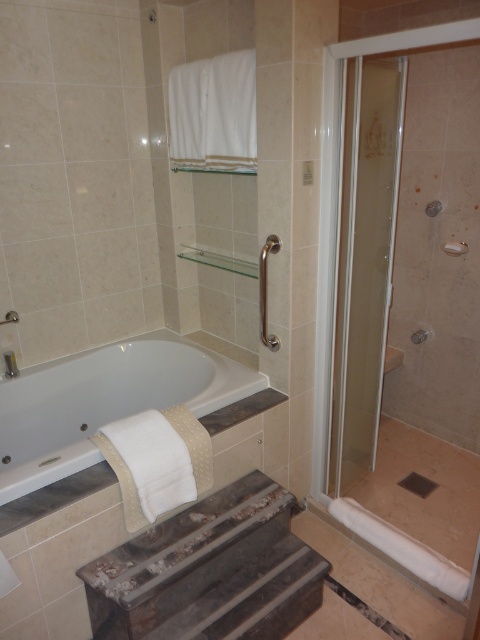
Looking at this image, you are trying to decide whether to place a new decorative item on either the clear glass shower door at right or the silver metallic towel bar at upper right. Based on their sizes, which location would allow the decorative item to be more visible?

The clear glass shower door at right has a larger size compared to the silver metallic towel bar at upper right, so placing the decorative item on the clear glass shower door at right would make it more visible.

You are a contractor measuring the bathroom layout. You need to install a new shower curtain rod that must be shorter than the clear glass shower door at right. Can the silver metallic towel bar at upper right be used as a reference for the maximum height of the curtain rod?

The clear glass shower door at right has a greater height compared to the silver metallic towel bar at upper right. Therefore, the silver metallic towel bar at upper right can be used as a reference for the maximum height of the curtain rod since it is shorter than the shower door.

You are standing in the bathroom and want to grab a towel. Which one is easier to reach, the white fabric towel at lower left or the silver metallic towel bar at upper right?

The white fabric towel at lower left is closer to the viewer than the silver metallic towel bar at upper right, so it is easier to reach.